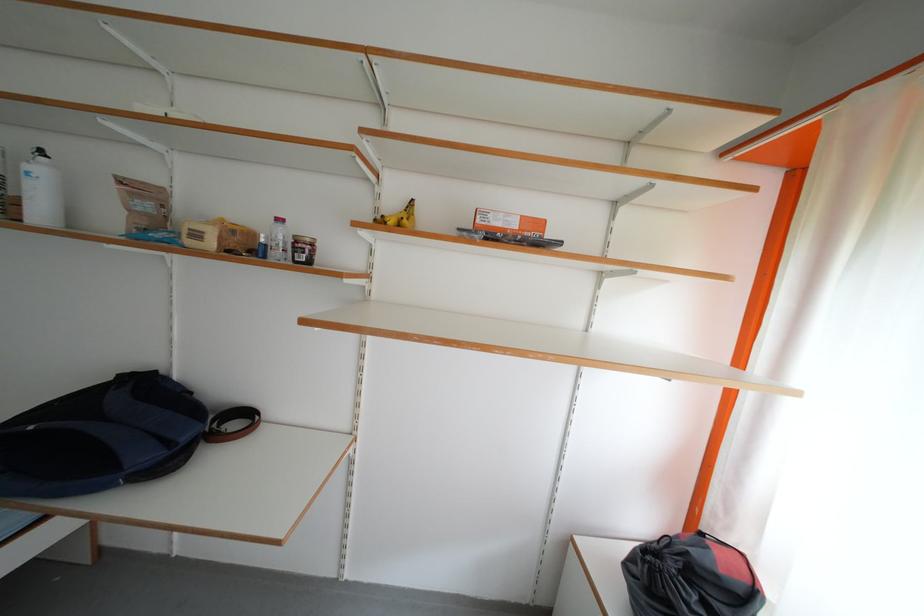
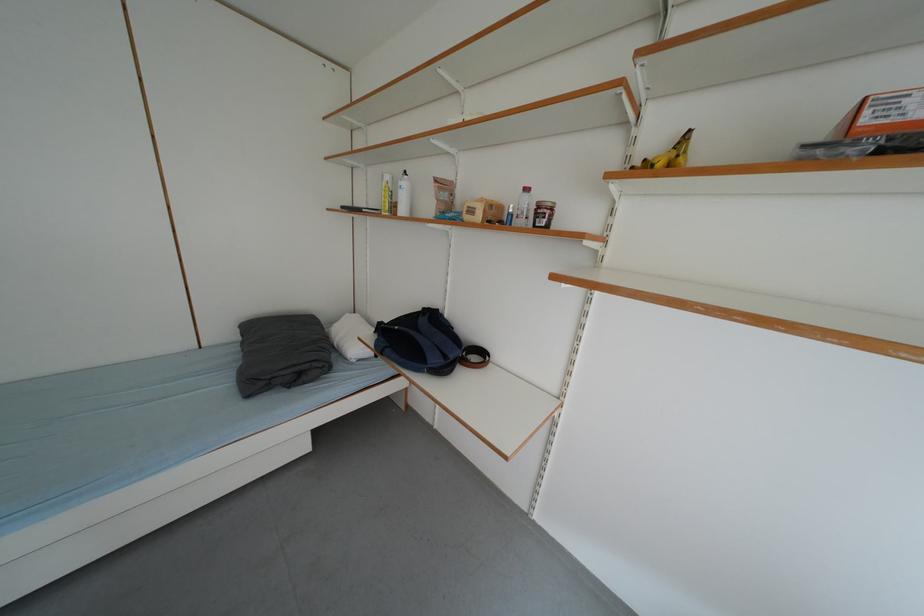
Locate, in the second image, the point that corresponds to the point at 283,248 in the first image.

(528, 216)